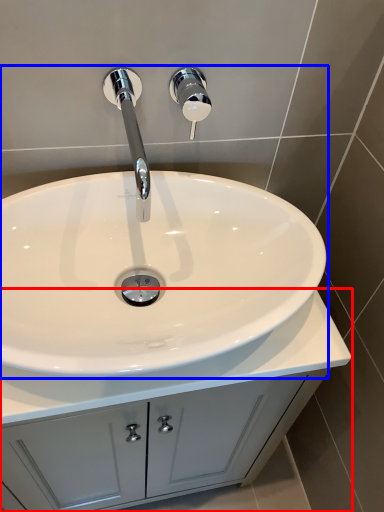
Question: Which of the following is the closest to the observer, bathroom cabinet (highlighted by a red box) or sink (highlighted by a blue box)?

Choices:
 (A) bathroom cabinet
 (B) sink

Answer: (B)